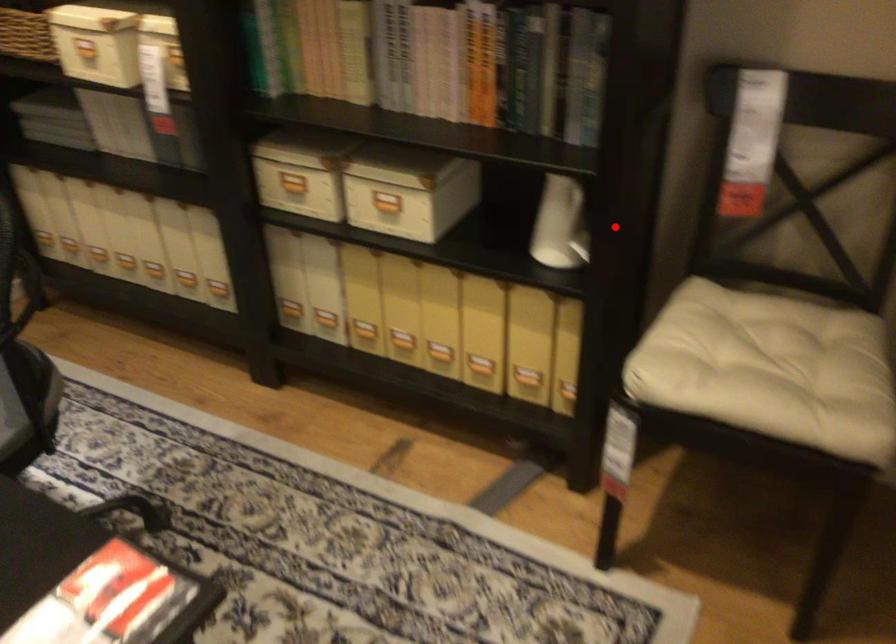
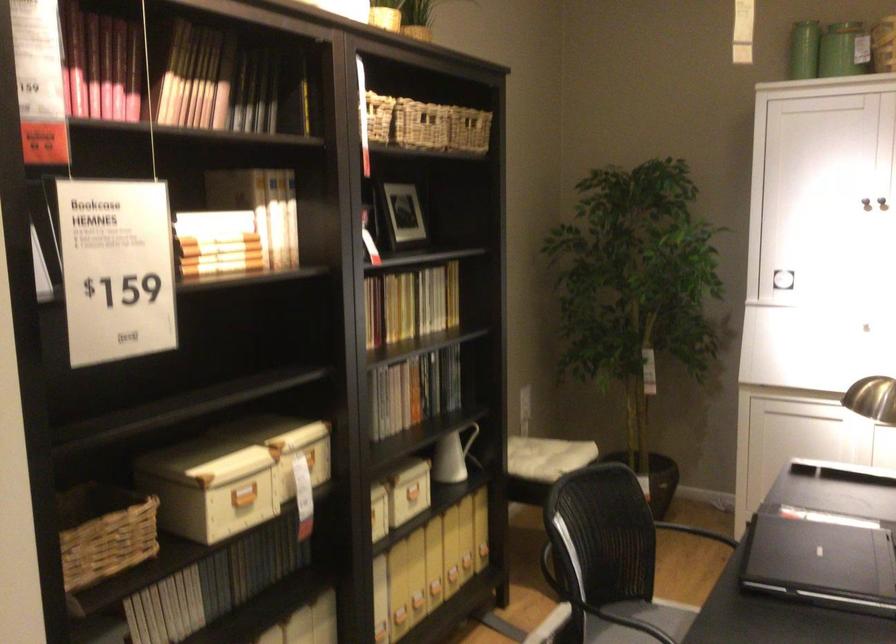
Question: I am providing you with two images of the same scene from different viewpoints. Given a red point in image1, look at the same physical point in image2. Is it:

Choices:
 (A) Closer to the viewpoint
 (B) Farther from the viewpoint

Answer: (B)